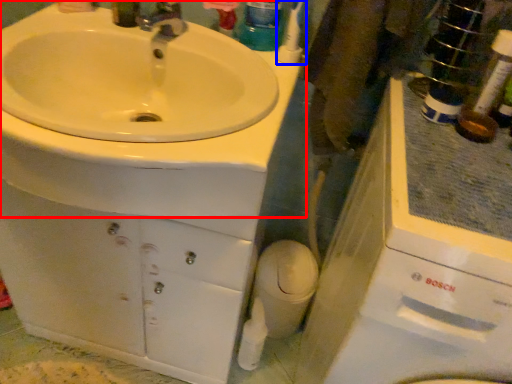
Question: Which object appears closest to the camera in this image, sink (highlighted by a red box) or toothbrush (highlighted by a blue box)?

Choices:
 (A) sink
 (B) toothbrush

Answer: (A)